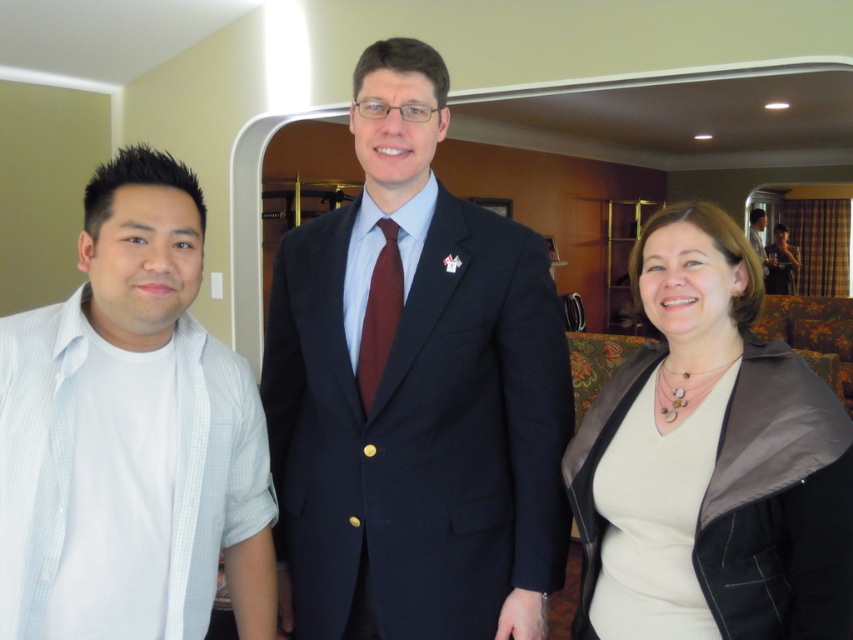
Question: Can you confirm if white cotton shirt at left is positioned to the right of dark blue suit at center?

Choices:
 (A) yes
 (B) no

Answer: (B)

Question: From the image, what is the correct spatial relationship of navy blue suit at center in relation to burgundy silk tie at center?

Choices:
 (A) below
 (B) above

Answer: (A)

Question: Which object is closer to the camera taking this photo?

Choices:
 (A) matte black jacket at lower right
 (B) white cotton shirt at left
 (C) burgundy silk tie at center
 (D) white matte dress at center

Answer: (B)

Question: Estimate the real-world distances between objects in this image. Which object is farther from the white cotton shirt at left?

Choices:
 (A) matte black jacket at lower right
 (B) burgundy silk tie at center

Answer: (A)

Question: Which point is closer to the camera?

Choices:
 (A) (753, 220)
 (B) (369, 72)
 (C) (793, 540)

Answer: (C)

Question: In this image, where is white cotton shirt at left located relative to white matte dress at center?

Choices:
 (A) above
 (B) below

Answer: (A)